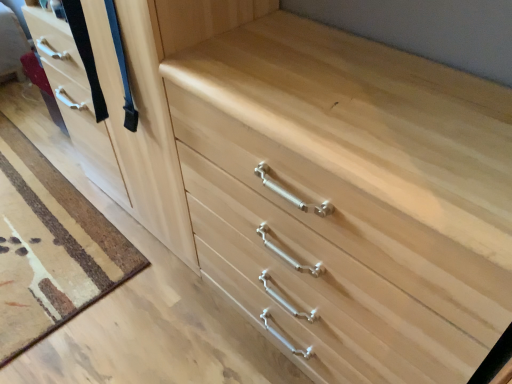
Question: Does matte wood door at left have a smaller size compared to natural wood drawer at center?

Choices:
 (A) yes
 (B) no

Answer: (B)

Question: Is natural wood drawer at center at the back of matte wood door at left?

Choices:
 (A) yes
 (B) no

Answer: (B)

Question: Is matte wood door at left surrounding natural wood drawer at center?

Choices:
 (A) yes
 (B) no

Answer: (B)

Question: Is matte wood door at left not close to natural wood drawer at center?

Choices:
 (A) yes
 (B) no

Answer: (B)

Question: From a real-world perspective, does matte wood door at left sit lower than natural wood drawer at center?

Choices:
 (A) yes
 (B) no

Answer: (B)

Question: Does matte wood door at left appear on the left side of natural wood drawer at center?

Choices:
 (A) yes
 (B) no

Answer: (A)

Question: From a real-world perspective, is natural wood drawer at center physically above matte wood door at left?

Choices:
 (A) no
 (B) yes

Answer: (A)

Question: Does natural wood drawer at center appear on the right side of matte wood door at left?

Choices:
 (A) no
 (B) yes

Answer: (B)

Question: Is natural wood drawer at center in contact with matte wood door at left?

Choices:
 (A) yes
 (B) no

Answer: (B)

Question: Is natural wood drawer at center turned away from matte wood door at left?

Choices:
 (A) yes
 (B) no

Answer: (B)

Question: Is natural wood drawer at center not close to matte wood door at left?

Choices:
 (A) yes
 (B) no

Answer: (B)

Question: From the image's perspective, would you say natural wood drawer at center is positioned over matte wood door at left?

Choices:
 (A) no
 (B) yes

Answer: (A)

Question: From the image's perspective, is natural wood drawer at center located above or below matte wood door at left?

Choices:
 (A) below
 (B) above

Answer: (A)